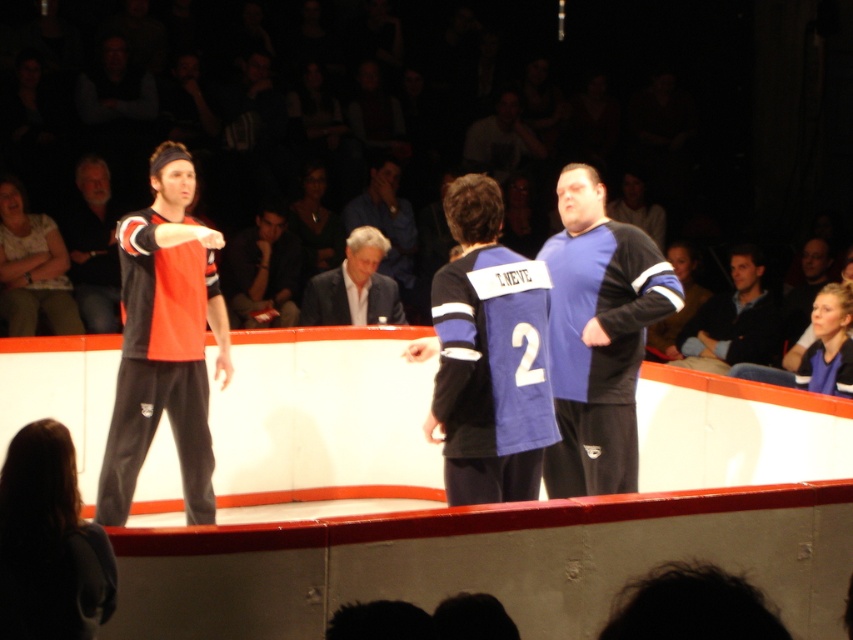
Who is shorter, matte black shirt at left or dark gray fabric jacket at center?

dark gray fabric jacket at center is shorter.

Is matte black shirt at left closer to the viewer compared to dark gray fabric jacket at center?

Yes, it is.

Find the location of `matte black shirt at left`. matte black shirt at left is located at coordinates (93, 248).

Does matte black shirt at center have a greater width compared to dark blue sweater at right?

Incorrect, matte black shirt at center's width does not surpass dark blue sweater at right's.

In order to click on matte black shirt at center in this screenshot , I will do `click(164, 340)`.

Who is higher up, dark blue sweater at right or dark gray suit at center?

dark gray suit at center is higher up.

The image size is (853, 640). What do you see at coordinates (730, 321) in the screenshot?
I see `dark blue sweater at right` at bounding box center [730, 321].

You are a GUI agent. You are given a task and a screenshot of the screen. Output one action in this format:
    pyautogui.click(x=<x>, y=<y>)
    Task: Click on the dark blue sweater at right
    This screenshot has width=853, height=640.
    Given the screenshot: What is the action you would take?
    pyautogui.click(x=730, y=321)